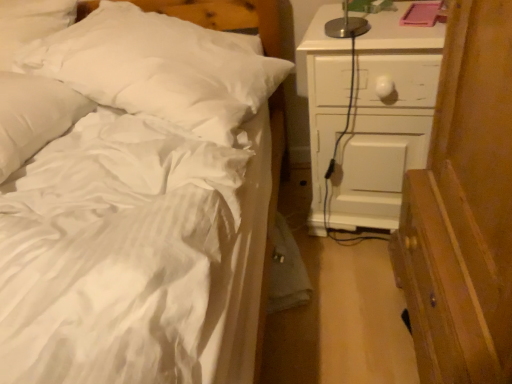
Question: Looking at the image, does white painted wood chest of drawers at right seem bigger or smaller compared to white soft pillow at upper left, the first pillow viewed from the right?

Choices:
 (A) small
 (B) big

Answer: (A)

Question: Considering the relative positions of white painted wood chest of drawers at right and white soft pillow at upper left, the first pillow viewed from the right, in the image provided, is white painted wood chest of drawers at right to the left or to the right of white soft pillow at upper left, the first pillow viewed from the right,?

Choices:
 (A) right
 (B) left

Answer: (A)

Question: Based on their relative distances, which object is farther from the white soft pillow at upper left, the first pillow viewed from the right?

Choices:
 (A) white painted wood chest of drawers at right
 (B) white soft pillow at upper left, which is counted as the second pillow, starting from the right

Answer: (A)

Question: Based on their relative distances, which object is farther from the white soft pillow at upper left, the first pillow viewed from the right?

Choices:
 (A) white soft pillow at upper left, marked as the 1th pillow in a left-to-right arrangement
 (B) white painted wood chest of drawers at right

Answer: (B)